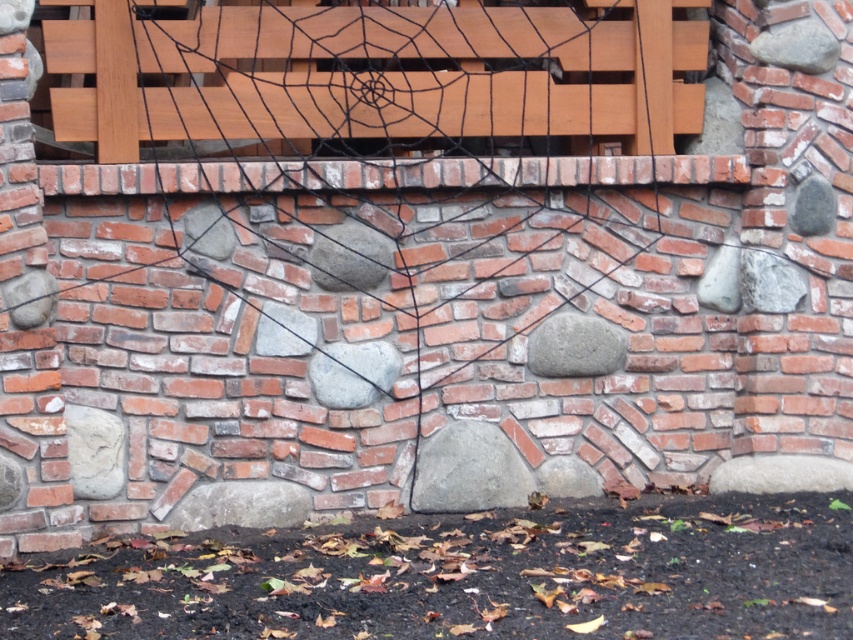
Question: Is black netting spider web at center closer to the viewer compared to matte wooden bench at upper center?

Choices:
 (A) no
 (B) yes

Answer: (B)

Question: Does black netting spider web at center have a greater width compared to matte wooden bench at upper center?

Choices:
 (A) no
 (B) yes

Answer: (B)

Question: Which is farther from the gray matte rock at center?

Choices:
 (A) matte wooden bench at upper center
 (B) black netting spider web at center

Answer: (A)

Question: Estimate the real-world distances between objects in this image. Which object is closer to the black netting spider web at center?

Choices:
 (A) matte wooden bench at upper center
 (B) gray matte rock at center

Answer: (A)

Question: Based on their relative distances, which object is nearer to the gray matte rock at center?

Choices:
 (A) black netting spider web at center
 (B) matte wooden bench at upper center

Answer: (A)

Question: Is matte wooden bench at upper center to the right of gray matte rock at center from the viewer's perspective?

Choices:
 (A) no
 (B) yes

Answer: (A)